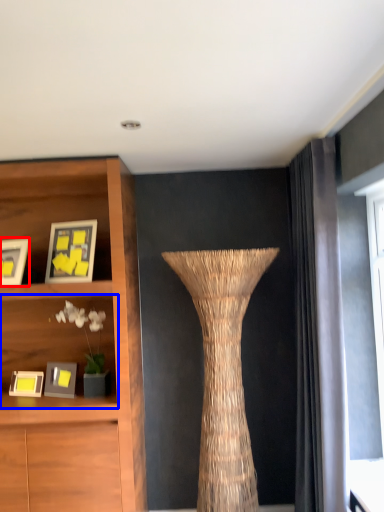
Question: Which of the following is the farthest to the observer, picture frame (highlighted by a red box) or shelf (highlighted by a blue box)?

Choices:
 (A) picture frame
 (B) shelf

Answer: (B)